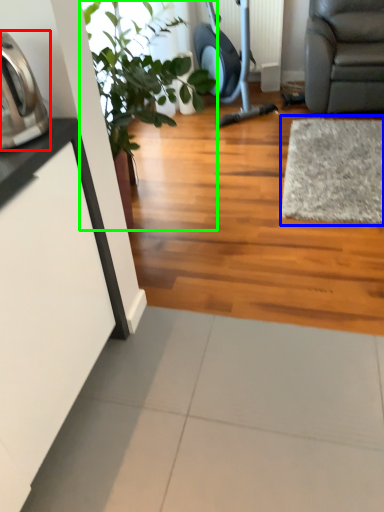
Question: Estimate the real-world distances between objects in this image. Which object is farther from appliance (highlighted by a red box), mat (highlighted by a blue box) or houseplant (highlighted by a green box)?

Choices:
 (A) mat
 (B) houseplant

Answer: (A)